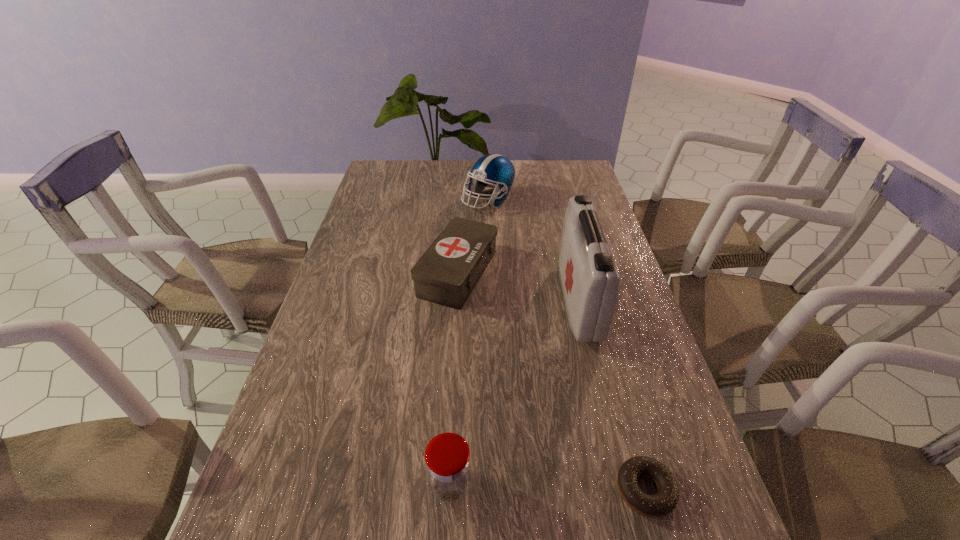
At what (x,y) coordinates should I click in order to perform the action: click on the right first-aid kit. Please return your answer as a coordinate pair (x, y). This screenshot has width=960, height=540. Looking at the image, I should click on (589, 279).

The width and height of the screenshot is (960, 540). Identify the location of the tallest object. (589, 279).

What are the coordinates of `the fourth shortest object` in the screenshot? It's located at (495, 171).

The image size is (960, 540). What are the coordinates of `football helmet` in the screenshot? It's located at (495, 171).

Locate an element on the screen. The image size is (960, 540). the third shortest object is located at coordinates (448, 464).

This screenshot has height=540, width=960. Identify the location of the second shortest object. (446, 274).

Identify the location of the shorter first-aid kit. This screenshot has height=540, width=960. (446, 274).

Locate an element on the screen. The height and width of the screenshot is (540, 960). the shortest object is located at coordinates click(662, 503).

The height and width of the screenshot is (540, 960). In order to click on free space located 0.130m on the front side of the taller first-aid kit in this screenshot , I will do `click(517, 301)`.

This screenshot has height=540, width=960. I want to click on blank space located 0.400m on the front side of the taller first-aid kit, so click(x=420, y=301).